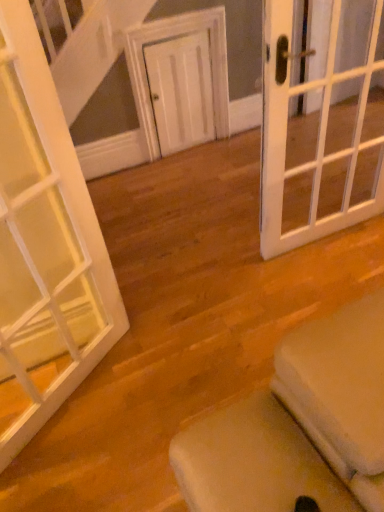
Question: Considering the positions of white glass door at right, which is the 1th door in right-to-left order, and white glass door at left, which is counted as the 1th door, starting from the front, in the image, is white glass door at right, which is the 1th door in right-to-left order, wider or thinner than white glass door at left, which is counted as the 1th door, starting from the front,?

Choices:
 (A) wide
 (B) thin

Answer: (A)

Question: From their relative heights in the image, would you say white glass door at right, the 2th door from the back, is taller or shorter than white glass door at left, positioned as the third door in right-to-left order?

Choices:
 (A) tall
 (B) short

Answer: (B)

Question: Estimate the real-world distances between objects in this image. Which object is farther from the white glass door at right, the 2th door from the back?

Choices:
 (A) white matte door at center, placed as the 2th door when sorted from left to right
 (B) white glass door at left, positioned as the third door in right-to-left order

Answer: (A)

Question: Which object is the farthest from the white matte door at center, which is counted as the 1th door, starting from the back?

Choices:
 (A) white glass door at left, which is counted as the third door, starting from the back
 (B) white glass door at right, the 2th door from the back

Answer: (A)